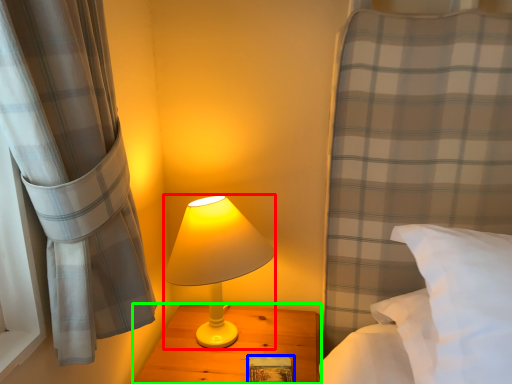
Question: Which is nearer to the lamp (highlighted by a red box)? book (highlighted by a blue box) or nightstand (highlighted by a green box).

Choices:
 (A) book
 (B) nightstand

Answer: (B)